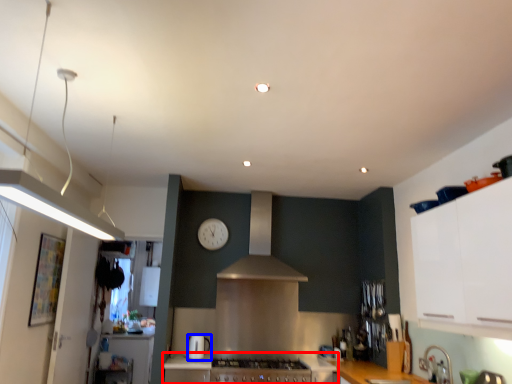
Question: Which object appears closest to the camera in this image, countertop (highlighted by a red box) or kitchen appliance (highlighted by a blue box)?

Choices:
 (A) countertop
 (B) kitchen appliance

Answer: (A)